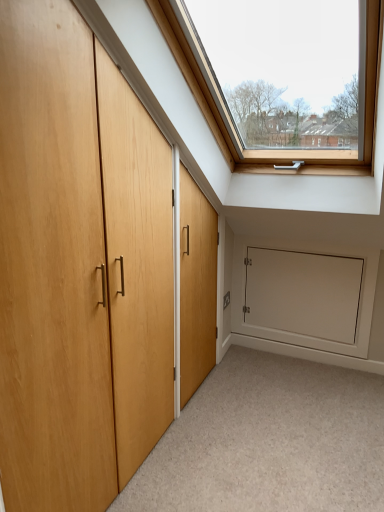
Question: From a real-world perspective, is light wood door at left physically below carpeted floor at lower center?

Choices:
 (A) no
 (B) yes

Answer: (A)

Question: From a real-world perspective, does light wood door at left stand above carpeted floor at lower center?

Choices:
 (A) yes
 (B) no

Answer: (A)

Question: Is light wood door at left further to camera compared to carpeted floor at lower center?

Choices:
 (A) yes
 (B) no

Answer: (B)

Question: Does light wood door at left appear on the left side of carpeted floor at lower center?

Choices:
 (A) yes
 (B) no

Answer: (A)

Question: Does light wood door at left have a greater height compared to carpeted floor at lower center?

Choices:
 (A) no
 (B) yes

Answer: (B)

Question: Considering the relative sizes of light wood door at left and carpeted floor at lower center in the image provided, is light wood door at left smaller than carpeted floor at lower center?

Choices:
 (A) no
 (B) yes

Answer: (A)

Question: Considering the relative sizes of white matte door at lower right and carpeted floor at lower center in the image provided, is white matte door at lower right bigger than carpeted floor at lower center?

Choices:
 (A) no
 (B) yes

Answer: (A)

Question: Is white matte door at lower right far away from carpeted floor at lower center?

Choices:
 (A) no
 (B) yes

Answer: (A)

Question: Can you confirm if white matte door at lower right is smaller than carpeted floor at lower center?

Choices:
 (A) yes
 (B) no

Answer: (A)

Question: From a real-world perspective, is white matte door at lower right beneath carpeted floor at lower center?

Choices:
 (A) yes
 (B) no

Answer: (B)

Question: Is carpeted floor at lower center inside white matte door at lower right?

Choices:
 (A) yes
 (B) no

Answer: (B)

Question: Is the depth of white matte door at lower right greater than that of carpeted floor at lower center?

Choices:
 (A) no
 (B) yes

Answer: (B)

Question: Considering the relative sizes of carpeted floor at lower center and white matte door at lower right in the image provided, is carpeted floor at lower center thinner than white matte door at lower right?

Choices:
 (A) no
 (B) yes

Answer: (A)